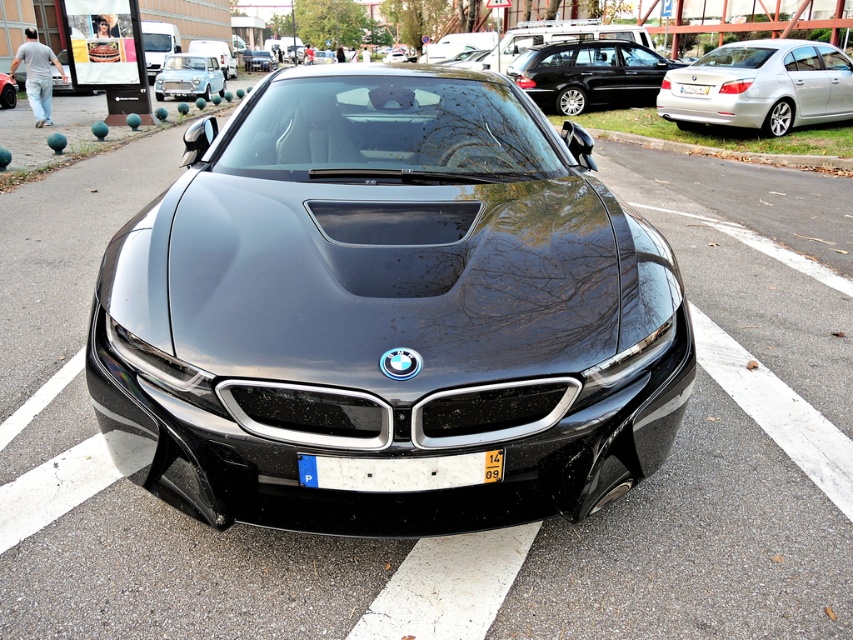
Question: Which point appears closest to the camera in this image?

Choices:
 (A) (416, 490)
 (B) (192, 92)
 (C) (660, 74)

Answer: (A)

Question: Which of the following is the closest to the observer?

Choices:
 (A) metallic silver sedan at center
 (B) light blue metallic sedan at upper left

Answer: (B)

Question: Is metallic silver sedan at center smaller than yellow matte license plate at center?

Choices:
 (A) yes
 (B) no

Answer: (B)

Question: Considering the real-world distances, which object is farthest from the light blue metallic sedan at upper left?

Choices:
 (A) glossy black car at center
 (B) silver metallic sedan at upper right
 (C) shiny black sedan at center

Answer: (B)

Question: Can you confirm if silver metallic sedan at upper right is positioned above white plastic license plate at center?

Choices:
 (A) yes
 (B) no

Answer: (A)

Question: Does white plastic license plate at center have a lesser width compared to glossy black car at center?

Choices:
 (A) yes
 (B) no

Answer: (A)